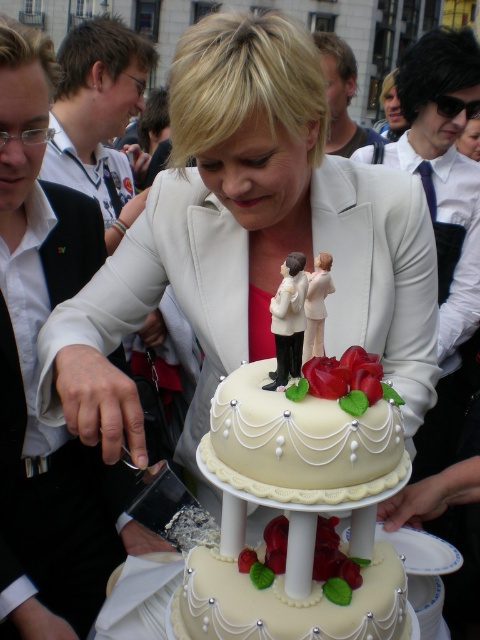
Does point (60, 456) come farther from viewer compared to point (339, 145)?

No.

Which is in front, point (81, 593) or point (335, 77)?

Point (81, 593) is in front.

Measure the distance between point (66, 502) and camera.

The distance of point (66, 502) from camera is 48.94 meters.

Where is `white shirt at left`? white shirt at left is located at coordinates (36, 371).

Between point (203, 99) and point (335, 108), which one is positioned in front?

Point (203, 99) is in front.

Is white glossy cake at center to the left of dark brown hair at upper center from the viewer's perspective?

Indeed, white glossy cake at center is positioned on the left side of dark brown hair at upper center.

Between point (93, 358) and point (357, 128), which one is positioned in front?

Point (93, 358)

Locate an element on the screen. white glossy cake at center is located at coordinates (252, 236).

Which is below, white glossy cake at center or ivory fondant cake at center?

Positioned lower is ivory fondant cake at center.

Which is behind, point (218, 243) or point (284, 550)?

The point (218, 243) is behind.

Locate an element on the screen. white glossy cake at center is located at coordinates (252, 236).